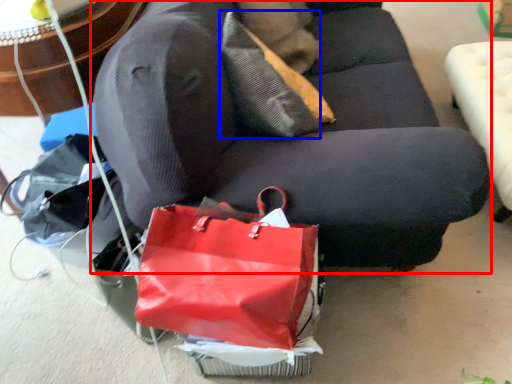
Question: Which of the following is the farthest to the observer, studio couch (highlighted by a red box) or pillow (highlighted by a blue box)?

Choices:
 (A) studio couch
 (B) pillow

Answer: (B)